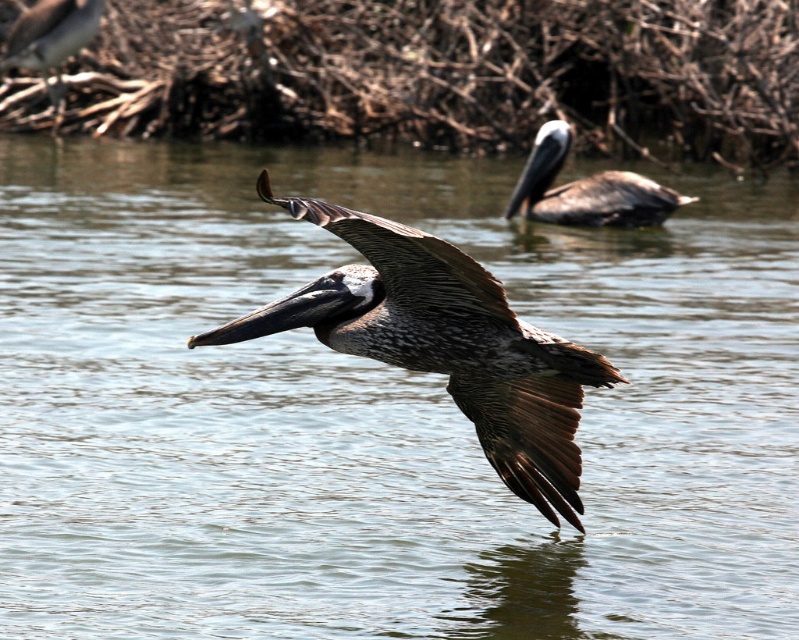
Based on the photo, you are observing two points in the image. The first point is at coordinates point (574, 410) and the second point is at point (541, 193). From your perspective, which point is closer to you?

Point (574, 410) is in front of point (541, 193), so it is closer to you.

You are observing two pelicans in the image. One is the brown feathered pelican at center, and the other is partially submerged in the water. Based on their positions, which pelican is closer to the center of the image?

The brown feathered pelican at center is exactly at the center of the image, so it is closer to the center than the other pelican which is partially submerged in the water.

You are a birdwatcher trying to identify the pelican species in the image. The image has a point marked at coordinates (444, 342). Which pelican in the image is located at this point?

The point at coordinates (444, 342) indicates the brown feathered pelican at center.